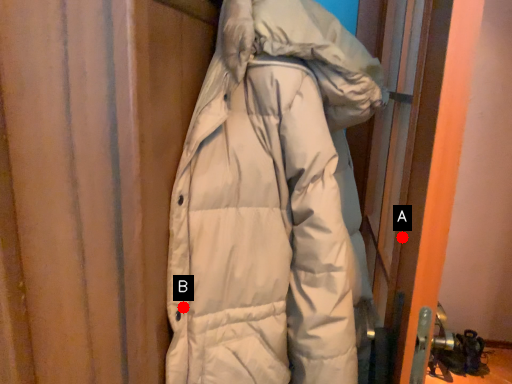
Question: Two points are circled on the image, labeled by A and B beside each circle. Among these points, which one is farthest from the camera?

Choices:
 (A) A is further
 (B) B is further

Answer: (A)